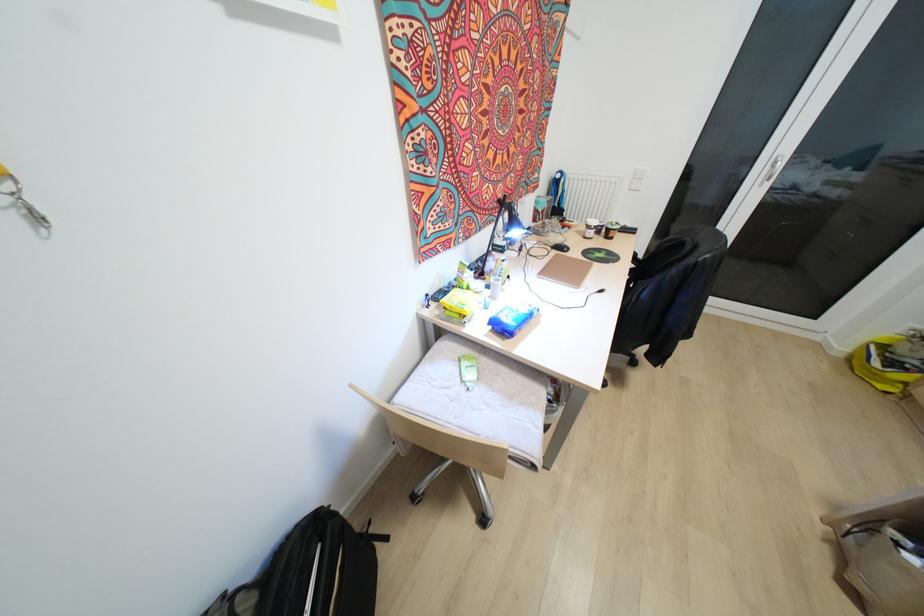
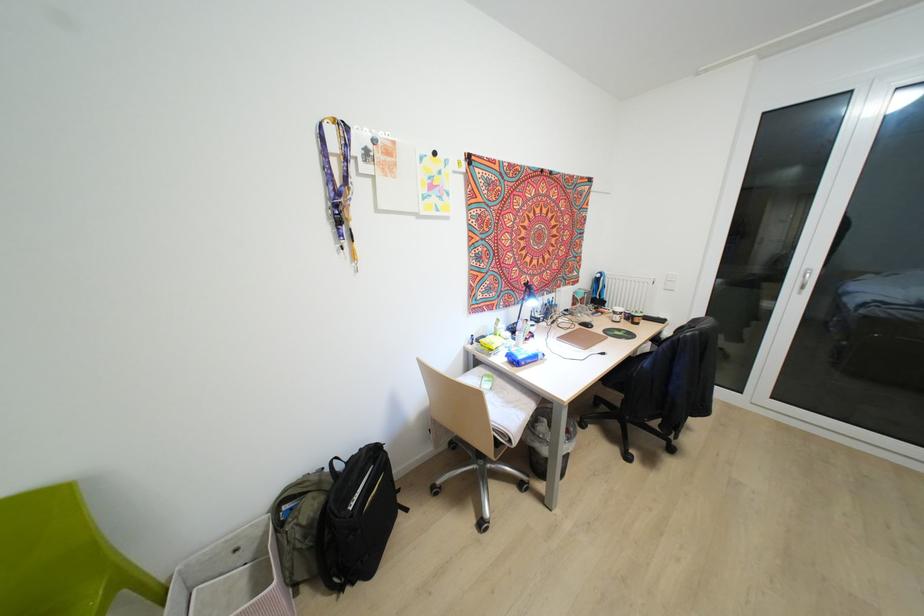
The point at [543,273] is marked in the first image. Where is the corresponding point in the second image?

(563, 338)